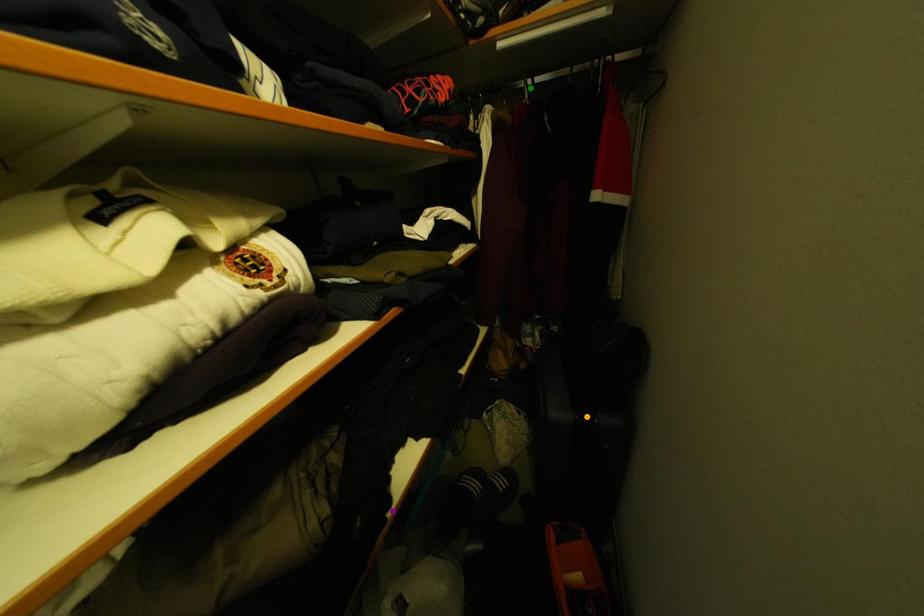
Order these from farthest to nearest:
purple point, green point, orange point

orange point → green point → purple point